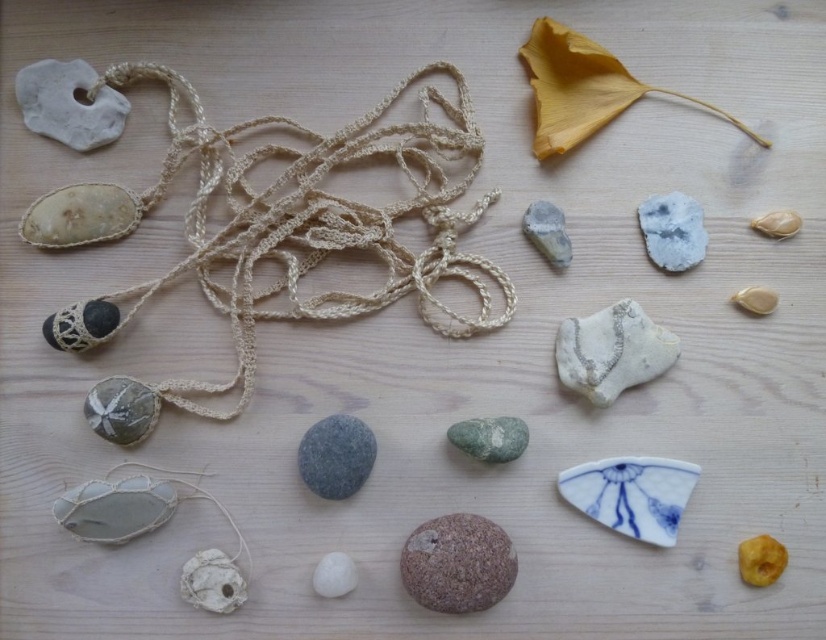
You are an artisan creating a new piece of jewelry. You have two materials to choose from at the upper right corner of your workspace. Which one is wider? The white matte rock at upper right or the matte beige seashell at upper right?

The white matte rock at upper right is wider than the matte beige seashell at upper right.

Based on the photo, you are an artisan creating a necklace and have the white matte rock at upper right and the smooth gray stone at center available. Which stone can you use if you need a larger piece for the centerpiece?

The smooth gray stone at center is larger than the white matte rock at upper right, so it would be suitable for the centerpiece.

You are looking at the two points labeled as point (55, 106) and point (699, 224). Which one appears closer to you?

Point (55, 106) is closer to the camera than point (699, 224), so it appears closer to you.